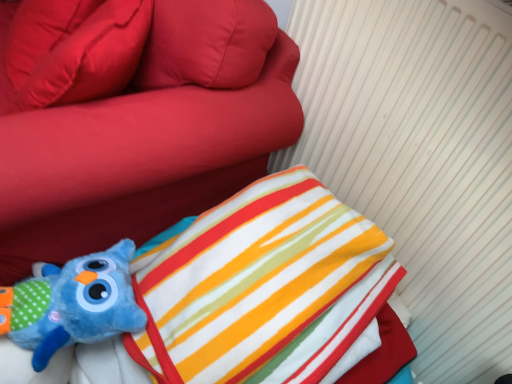
Question: Is soft plush toy at lower left taller or shorter than matte red pillow at upper left?

Choices:
 (A) tall
 (B) short

Answer: (A)

Question: From the image's perspective, relative to matte red pillow at upper left, is soft plush toy at lower left above or below?

Choices:
 (A) below
 (B) above

Answer: (B)

Question: Which object is the farthest from the blue plush toy at lower left?

Choices:
 (A) matte red pillow at upper left
 (B) soft plush toy at lower left

Answer: (A)

Question: Estimate the real-world distances between objects in this image. Which object is closer to the matte red pillow at upper left?

Choices:
 (A) blue plush toy at lower left
 (B) soft plush toy at lower left

Answer: (B)